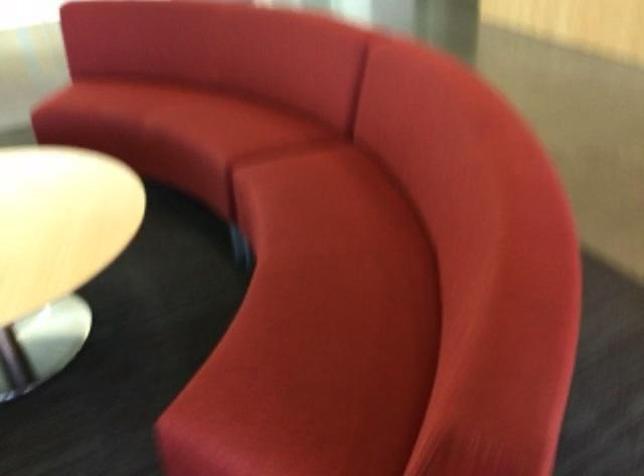
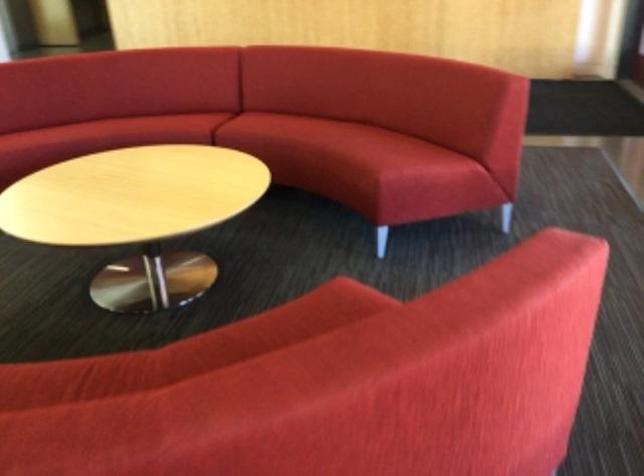
Where in the second image is the point corresponding to pixel 312 255 from the first image?

(326, 134)